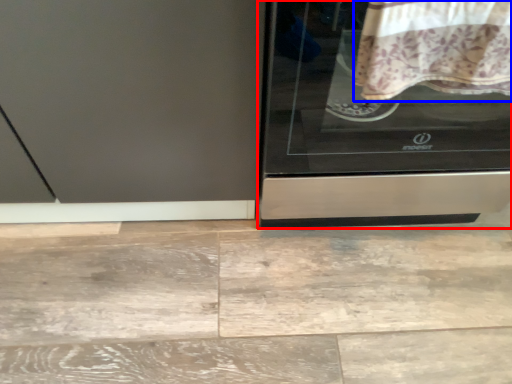
Question: Which object appears closest to the camera in this image, home appliance (highlighted by a red box) or blanket (highlighted by a blue box)?

Choices:
 (A) home appliance
 (B) blanket

Answer: (B)